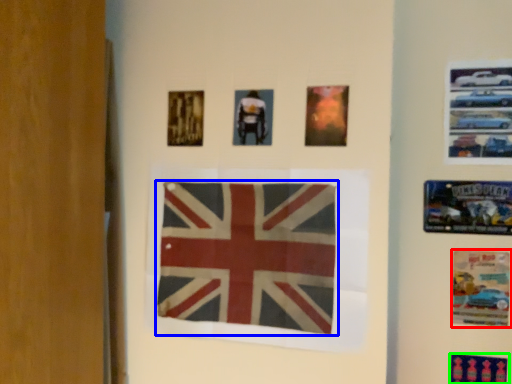
Question: Based on their relative distances, which object is farther from poster (highlighted by a red box)? Choose from flag (highlighted by a blue box) and poster (highlighted by a green box).

Choices:
 (A) flag
 (B) poster

Answer: (A)